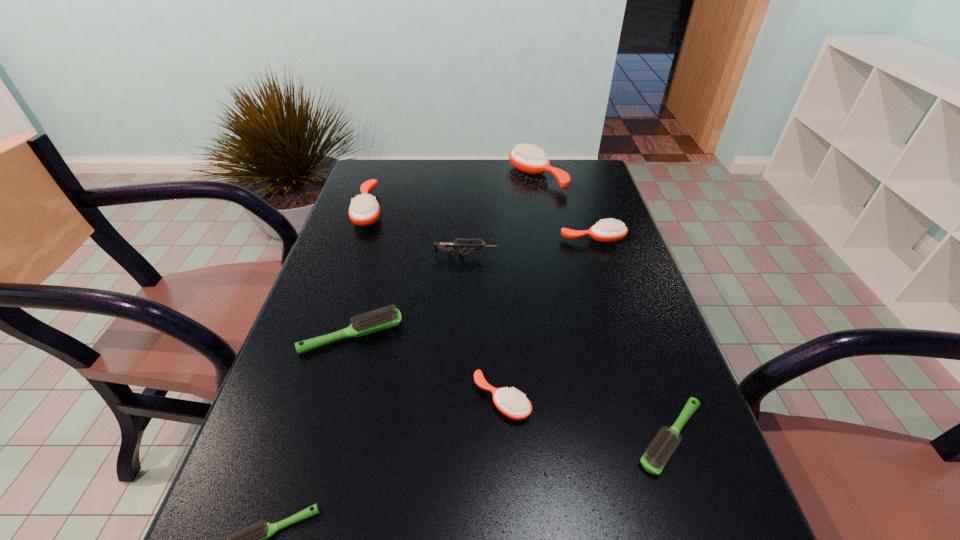
This screenshot has height=540, width=960. Identify the location of object positioned at the far left corner. (364, 210).

Find the location of a particular element. The height and width of the screenshot is (540, 960). object located at the far right corner is located at coordinates (528, 159).

In the image, there is a desktop. Where is `vacant space at the far edge`? vacant space at the far edge is located at coordinates (424, 190).

You are a GUI agent. You are given a task and a screenshot of the screen. Output one action in this format:
    pyautogui.click(x=<x>, y=<y>)
    Task: Click on the vacant space at the left edge of the desktop
    The height and width of the screenshot is (540, 960).
    Given the screenshot: What is the action you would take?
    pyautogui.click(x=344, y=278)

Where is `vacant position at the right edge of the desktop`? vacant position at the right edge of the desktop is located at coordinates (669, 476).

Locate an element on the screen. Image resolution: width=960 pixels, height=540 pixels. free space at the far left corner is located at coordinates (407, 173).

Where is `vacant area at the far right corner of the desktop`? vacant area at the far right corner of the desktop is located at coordinates (597, 173).

Image resolution: width=960 pixels, height=540 pixels. What are the coordinates of `free space between the grey gun and the second smallest orange hairbrush` in the screenshot? It's located at (530, 247).

I want to click on unoccupied area between the fourth farthest hairbrush and the fourth farthest object, so click(410, 295).

Locate an element on the screen. vacant area that lies between the second smallest orange hairbrush and the smallest orange hairbrush is located at coordinates (547, 319).